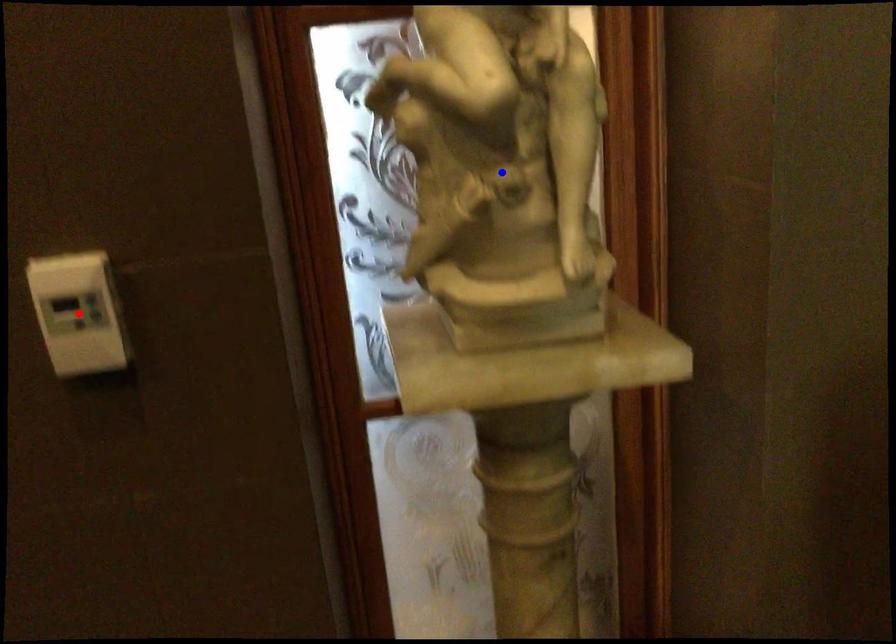
Question: In the image, two points are highlighted. Which point is nearer to the camera? Reply with the corresponding letter.

Choices:
 (A) blue point
 (B) red point

Answer: (B)